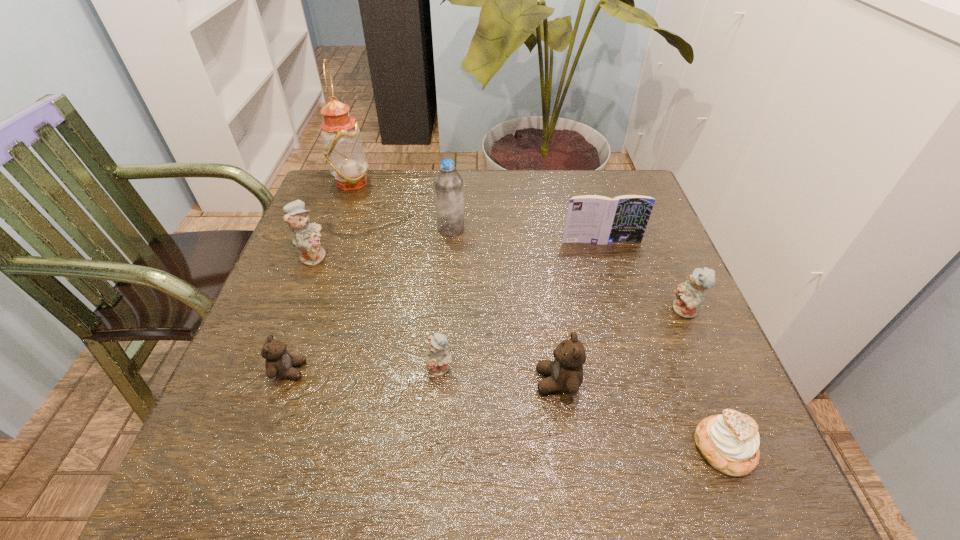
The image size is (960, 540). Find the location of `the farthest object`. the farthest object is located at coordinates (343, 148).

The width and height of the screenshot is (960, 540). I want to click on the tallest object, so click(343, 148).

I want to click on the second tallest object, so click(x=449, y=198).

Where is `the eighth nearest object`? The width and height of the screenshot is (960, 540). the eighth nearest object is located at coordinates (449, 198).

Locate an element on the screen. the leftmost blue teddy bear is located at coordinates (306, 235).

The image size is (960, 540). Find the location of `the farthest blue teddy bear`. the farthest blue teddy bear is located at coordinates (306, 235).

This screenshot has width=960, height=540. Find the location of `book`. book is located at coordinates (595, 219).

At what (x,y) coordinates should I click in order to perform the action: click on the second farthest blue teddy bear. Please return your answer as a coordinate pair (x, y). The image size is (960, 540). Looking at the image, I should click on (689, 295).

Locate an element on the screen. This screenshot has height=540, width=960. the second farthest teddy bear is located at coordinates (689, 295).

I want to click on the bigger brown teddy bear, so click(566, 372).